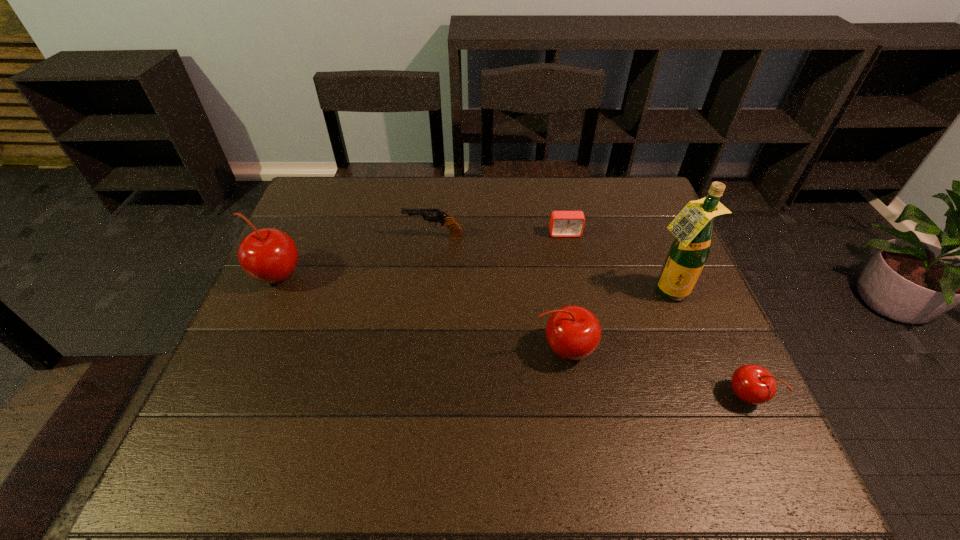
Locate an element on the screen. Image resolution: width=960 pixels, height=540 pixels. free spot located on the front of the second cherry from right to left is located at coordinates (573, 410).

You are a GUI agent. You are given a task and a screenshot of the screen. Output one action in this format:
    pyautogui.click(x=<x>, y=<y>)
    Task: Click on the vacant space located 0.320m on the back of the shortest cherry
    
    Given the screenshot: What is the action you would take?
    pyautogui.click(x=689, y=274)

At what (x,y) coordinates should I click in order to perform the action: click on free region located on the front-facing side of the shortest object. Please return your answer as a coordinate pair (x, y). This screenshot has height=540, width=960. Looking at the image, I should click on (570, 260).

Locate an element on the screen. This screenshot has width=960, height=540. vacant region located on the front-facing side of the tallest object is located at coordinates (703, 379).

Identify the location of free space located 0.060m along the barrel of the gun. (385, 237).

I want to click on free space located 0.100m along the barrel of the gun, so click(x=372, y=237).

Where is `free space located along the barrel of the gun`? Image resolution: width=960 pixels, height=540 pixels. free space located along the barrel of the gun is located at coordinates (374, 237).

Identify the location of object that is positioned at the near edge. (753, 384).

You are a GUI agent. You are given a task and a screenshot of the screen. Output one action in this format:
    pyautogui.click(x=<x>, y=<y>)
    Task: Click on the object situated at the left edge
    This screenshot has height=540, width=960.
    Given the screenshot: What is the action you would take?
    pyautogui.click(x=268, y=255)

What are the coordinates of `cherry that is at the right edge` in the screenshot? It's located at (753, 384).